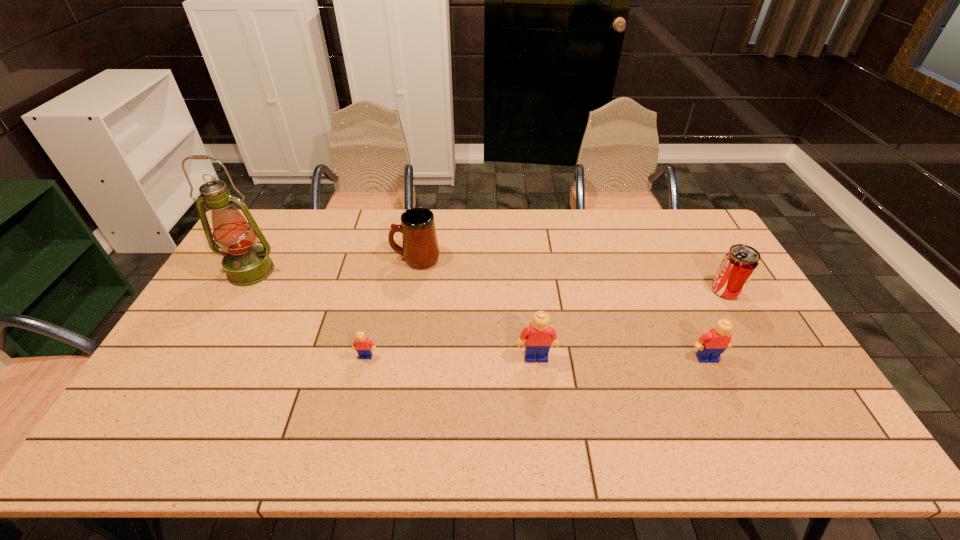
Locate an element on the screen. The height and width of the screenshot is (540, 960). the shortest object is located at coordinates (361, 344).

This screenshot has height=540, width=960. What are the coordinates of `the leftmost Lego` in the screenshot? It's located at (361, 344).

The width and height of the screenshot is (960, 540). What are the coordinates of `the third object from right to left` in the screenshot? It's located at (539, 336).

Image resolution: width=960 pixels, height=540 pixels. I want to click on the rightmost Lego, so click(x=711, y=345).

Find the location of a particular element. This screenshot has height=540, width=960. the second tallest Lego is located at coordinates (711, 345).

You are a GUI agent. You are given a task and a screenshot of the screen. Output one action in this format:
    pyautogui.click(x=<x>, y=<y>)
    Task: Click on the mug
    The image size is (960, 540).
    Given the screenshot: What is the action you would take?
    pyautogui.click(x=420, y=250)

Where is `the tallest object`? The width and height of the screenshot is (960, 540). the tallest object is located at coordinates (245, 263).

Image resolution: width=960 pixels, height=540 pixels. I want to click on the leftmost object, so click(245, 263).

You are a GUI agent. You are given a task and a screenshot of the screen. Output one action in this format:
    pyautogui.click(x=<x>, y=<y>)
    Task: Click on the pop soda
    The height and width of the screenshot is (540, 960).
    Given the screenshot: What is the action you would take?
    pyautogui.click(x=739, y=264)

Locate an element on the screen. This screenshot has width=960, height=540. vacant space located on the face of the shortest object is located at coordinates (361, 379).